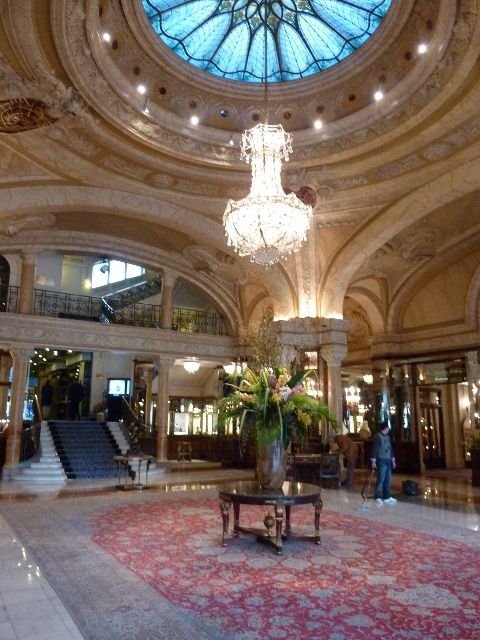
Between point (361, 38) and point (249, 205), which one is positioned in front?

Point (249, 205)

Which is in front, point (299, 33) or point (280, 241)?

Positioned in front is point (280, 241).

Find the location of `blue stained glass dome at center`. blue stained glass dome at center is located at coordinates (264, 33).